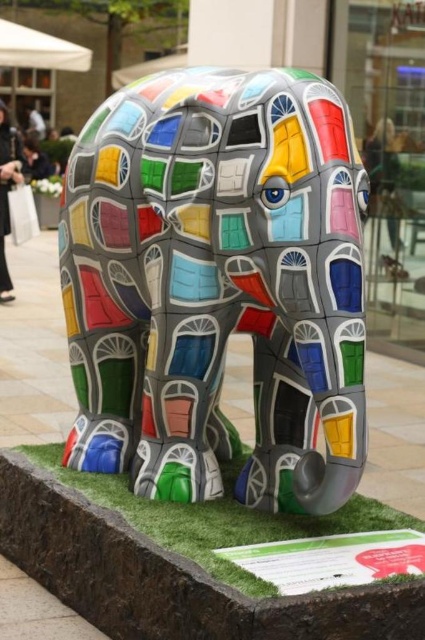
Measure the distance from multicolored mosaic elephant at center to green artificial turf at lower center.

18.64 inches

Image resolution: width=425 pixels, height=640 pixels. What are the coordinates of `multicolored mosaic elephant at center` in the screenshot? It's located at (218, 284).

Identify the location of multicolored mosaic elephant at center. (218, 284).